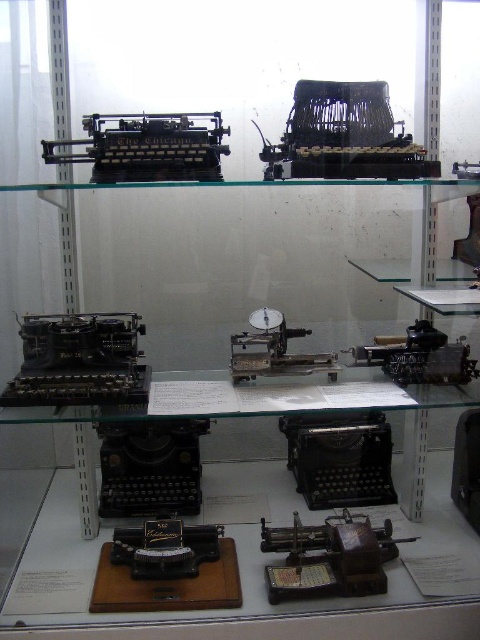
You are a museum visitor standing in front of the display case. You want to take a photo of the matte black typewriter at upper center without using a flash. Considering the lighting in the room, which is dim, will you be able to take a clear photo from your current position?

The matte black typewriter at upper center is 1.31 meters away from you. Since the distance is manageable and you can adjust your camera settings for low light, you should be able to take a clear photo without needing a flash.

Looking at this image, you are a museum visitor standing in front of the display case. You notice a point marked at coordinates [344,136]. What object is located at that specific point?

The point at coordinates [344,136] corresponds to the location of the matte black typewriter at upper center.